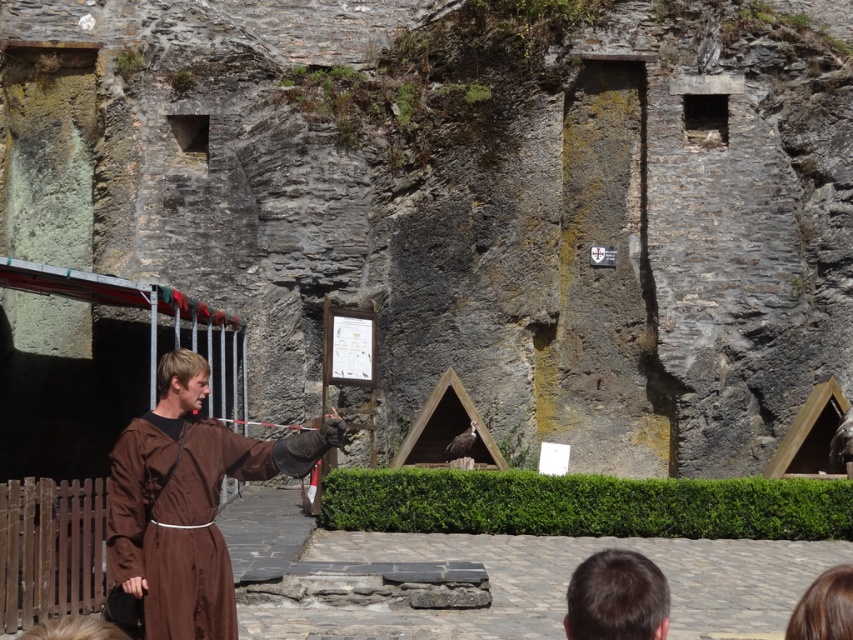
Which of these two, brown clothed man at center or brown hair at lower center, stands taller?

brown clothed man at center is taller.

Who is positioned more to the left, brown clothed man at center or brown hair at lower center?

brown clothed man at center

Does point (126, 620) come farther from viewer compared to point (589, 636)?

Yes, it is.

I want to click on brown clothed man at center, so click(184, 506).